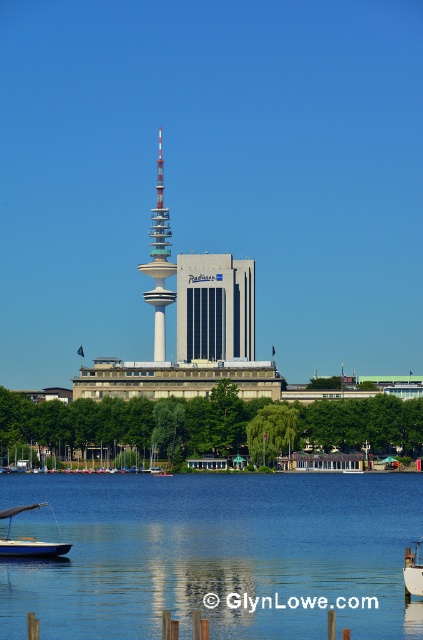
Question: Is matte glass building at center to the right of blue matte sailboat at lower left from the viewer's perspective?

Choices:
 (A) no
 (B) yes

Answer: (B)

Question: Which object is the closest to the blue liquid water at center?

Choices:
 (A) blue matte sailboat at lower left
 (B) white matte boat at center
 (C) white painted steel tower at center
 (D) matte glass building at center

Answer: (A)

Question: Is blue liquid water at center above white matte boat at center?

Choices:
 (A) no
 (B) yes

Answer: (B)

Question: Which of the following is the closest to the observer?

Choices:
 (A) tap(159, 296)
 (B) tap(214, 296)
 (C) tap(24, 508)
 (D) tap(409, 557)

Answer: (A)

Question: Which point is closer to the camera?

Choices:
 (A) (8, 548)
 (B) (406, 582)
 (C) (280, 588)

Answer: (C)

Question: Is blue liquid water at center to the right of white matte boat at center from the viewer's perspective?

Choices:
 (A) no
 (B) yes

Answer: (A)